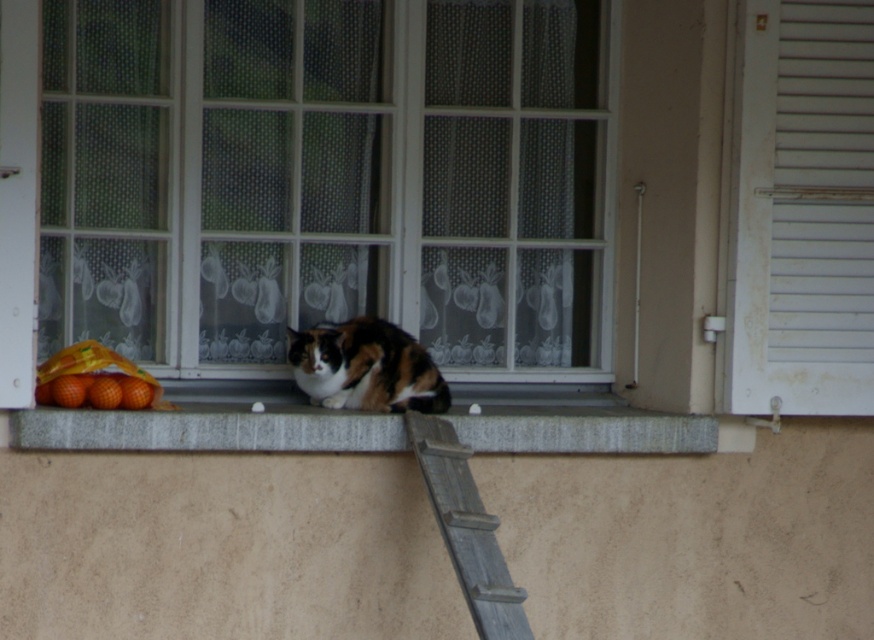
Question: Which is farther from the calico fur cat at center?

Choices:
 (A) white painted wood shutter at right
 (B) clear glass window at center

Answer: (A)

Question: Which point is closer to the camera?

Choices:
 (A) (205, 200)
 (B) (304, 332)
 (C) (442, 524)

Answer: (C)

Question: Which point is closer to the camera?

Choices:
 (A) (417, 378)
 (B) (796, 88)
 (C) (241, 106)
 (D) (456, 468)

Answer: (D)

Question: Considering the relative positions of clear glass window at center and calico fur cat at center in the image provided, where is clear glass window at center located with respect to calico fur cat at center?

Choices:
 (A) left
 (B) right

Answer: (A)

Question: Is the position of clear glass window at center more distant than that of gray stone window sill at center?

Choices:
 (A) no
 (B) yes

Answer: (B)

Question: Is calico fur cat at center to the left of rustic wood ladder at lower right from the viewer's perspective?

Choices:
 (A) yes
 (B) no

Answer: (A)